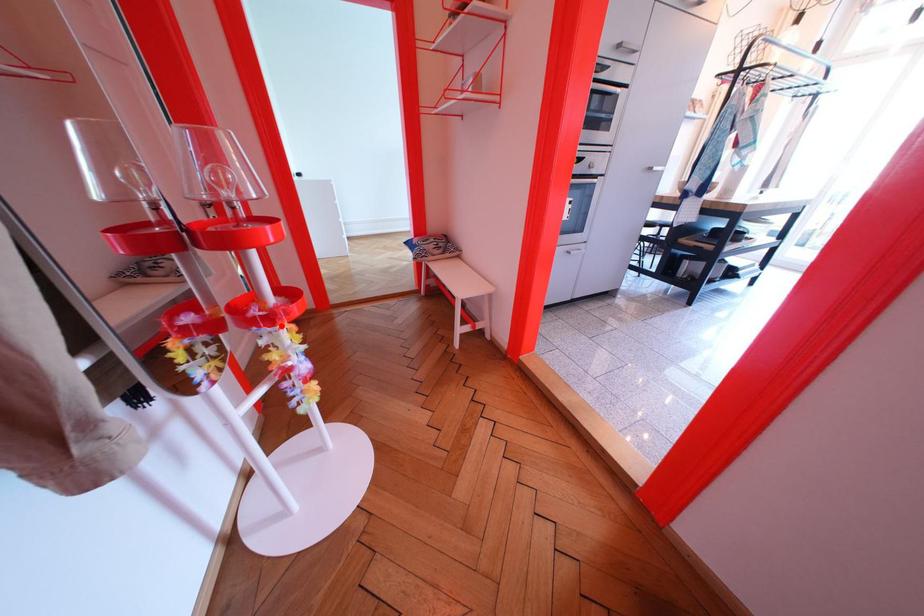
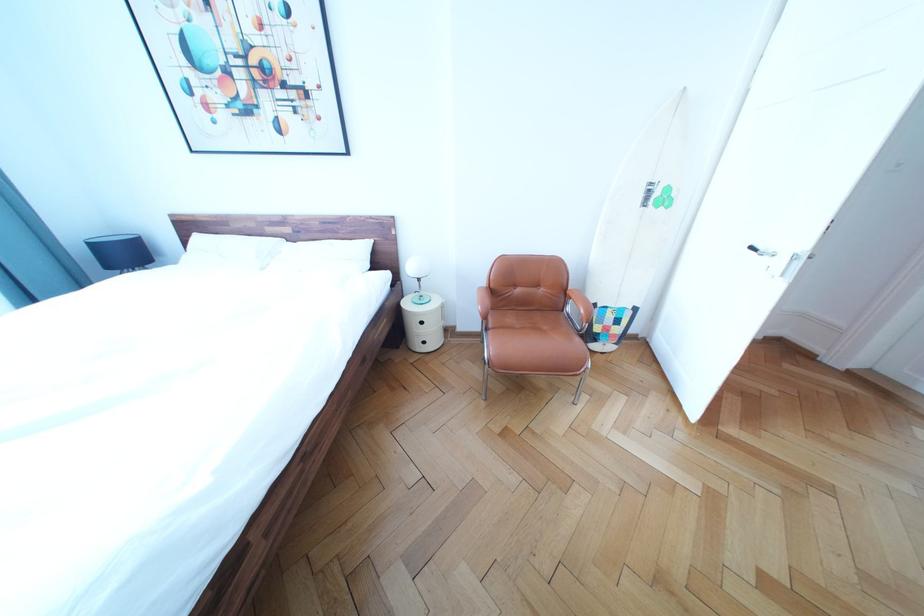
Question: I am providing you with two images of the same scene from different viewpoints. A red point is marked on the first image. At the location where the point appears in image 1, is it still visible in image 2?

Choices:
 (A) Yes
 (B) No

Answer: (B)